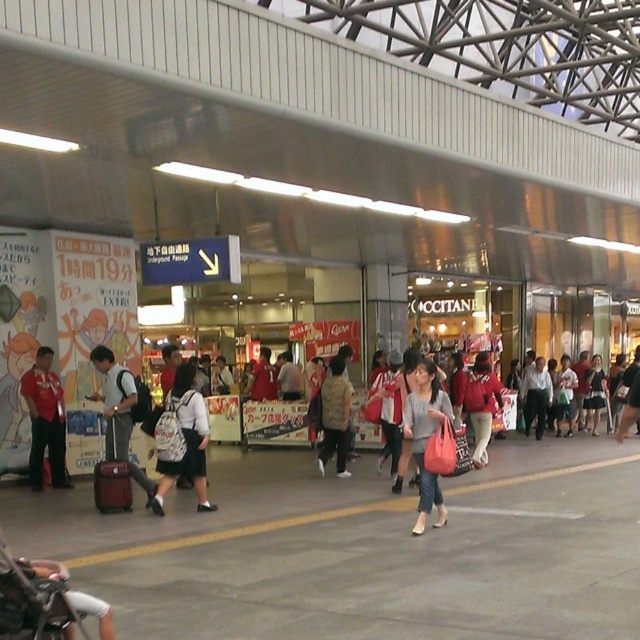
Is white backpack at center shorter than light brown backpack at center?

Yes.

Is point (164, 492) in front of point (332, 358)?

Yes, point (164, 492) is in front of point (332, 358).

Where is `white backpack at center`? Image resolution: width=640 pixels, height=640 pixels. white backpack at center is located at coordinates (180, 438).

Can you confirm if white backpack at center is positioned to the right of light gray fabric bag at center?

In fact, white backpack at center is to the left of light gray fabric bag at center.

Is white backpack at center to the left of light gray fabric bag at center from the viewer's perspective?

Indeed, white backpack at center is positioned on the left side of light gray fabric bag at center.

What are the coordinates of `white backpack at center` in the screenshot? It's located at (180, 438).

Based on the photo, is light brown backpack at center bigger than white shirt at center?

Incorrect, light brown backpack at center is not larger than white shirt at center.

Based on the photo, can you confirm if light brown backpack at center is smaller than white shirt at center?

Yes, light brown backpack at center is smaller than white shirt at center.

Does point (346, 417) come in front of point (531, 401)?

That is True.

Locate an element on the screen. The height and width of the screenshot is (640, 640). light brown backpack at center is located at coordinates (333, 417).